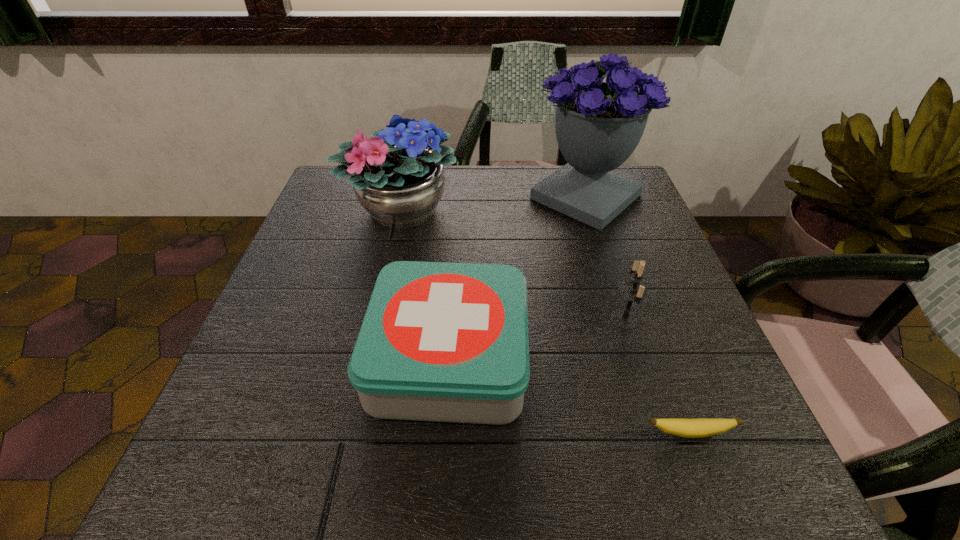
The image size is (960, 540). Find the location of `empty location between the shortest object and the taller bouquet`. empty location between the shortest object and the taller bouquet is located at coordinates (637, 315).

You are a GUI agent. You are given a task and a screenshot of the screen. Output one action in this format:
    pyautogui.click(x=<x>, y=<y>)
    Task: Click on the object that is the second closest one to the first-aid kit
    The width and height of the screenshot is (960, 540).
    Given the screenshot: What is the action you would take?
    pyautogui.click(x=633, y=292)

Identify which object is the second nearest to the banana. Please provide its 2D coordinates. Your answer should be formatted as a tuple, i.e. [(x, y)], where the tuple contains the x and y coordinates of a point satisfying the conditions above.

[(633, 292)]

Image resolution: width=960 pixels, height=540 pixels. In order to click on free space that satisfies the following two spatial constraints: 1. on the front side of the shorter bouquet; 2. on the left side of the third shortest object in this screenshot , I will do `click(377, 319)`.

This screenshot has width=960, height=540. I want to click on free point that satisfies the following two spatial constraints: 1. on the front side of the third shortest object; 2. on the left side of the left bouquet, so click(377, 319).

Identify the location of vacant space that satisfies the following two spatial constraints: 1. on the front side of the shortest object; 2. on the right side of the shorter bouquet. (351, 433).